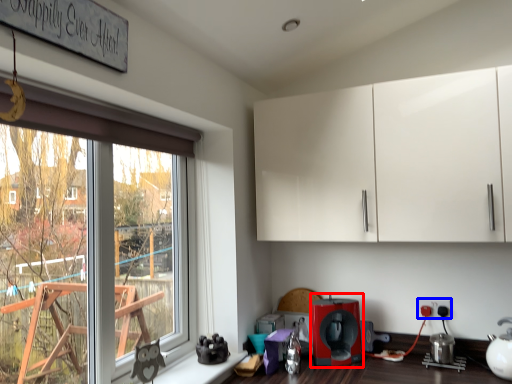
Question: Among these objects, which one is nearest to the camera, coffee machine (highlighted by a red box) or electric outlet (highlighted by a blue box)?

Choices:
 (A) coffee machine
 (B) electric outlet

Answer: (A)